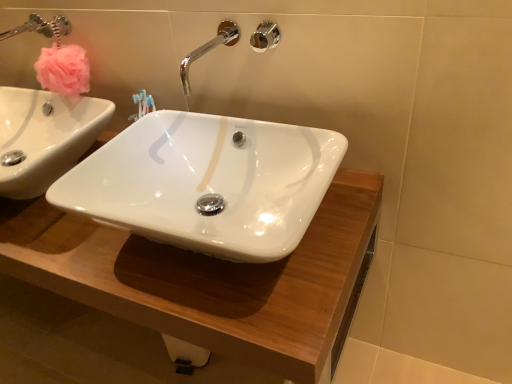
Question: Does white glossy wood counter top at center turn towards chrome/metallic faucet at upper center?

Choices:
 (A) no
 (B) yes

Answer: (A)

Question: Is white glossy wood counter top at center at the right side of chrome/metallic faucet at upper center?

Choices:
 (A) no
 (B) yes

Answer: (A)

Question: From a real-world perspective, is white glossy wood counter top at center physically above chrome/metallic faucet at upper center?

Choices:
 (A) yes
 (B) no

Answer: (B)

Question: From a real-world perspective, is white glossy wood counter top at center located beneath chrome/metallic faucet at upper center?

Choices:
 (A) yes
 (B) no

Answer: (A)

Question: From the image's perspective, is white glossy wood counter top at center located beneath chrome/metallic faucet at upper center?

Choices:
 (A) yes
 (B) no

Answer: (A)

Question: Is white glossy wood counter top at center positioned behind chrome/metallic faucet at upper center?

Choices:
 (A) no
 (B) yes

Answer: (A)

Question: Is polished chrome shower at upper center to the right of white glossy wood counter top at center from the viewer's perspective?

Choices:
 (A) yes
 (B) no

Answer: (A)

Question: Does polished chrome shower at upper center have a larger size compared to white glossy wood counter top at center?

Choices:
 (A) no
 (B) yes

Answer: (A)

Question: Can you confirm if polished chrome shower at upper center is positioned to the left of white glossy wood counter top at center?

Choices:
 (A) no
 (B) yes

Answer: (A)

Question: Can you confirm if polished chrome shower at upper center is taller than white glossy wood counter top at center?

Choices:
 (A) yes
 (B) no

Answer: (B)

Question: From a real-world perspective, is polished chrome shower at upper center beneath white glossy wood counter top at center?

Choices:
 (A) yes
 (B) no

Answer: (B)

Question: Is polished chrome shower at upper center wider than white glossy wood counter top at center?

Choices:
 (A) yes
 (B) no

Answer: (B)

Question: Is chrome/metallic faucet at upper center further to camera compared to polished chrome shower at upper center?

Choices:
 (A) yes
 (B) no

Answer: (B)